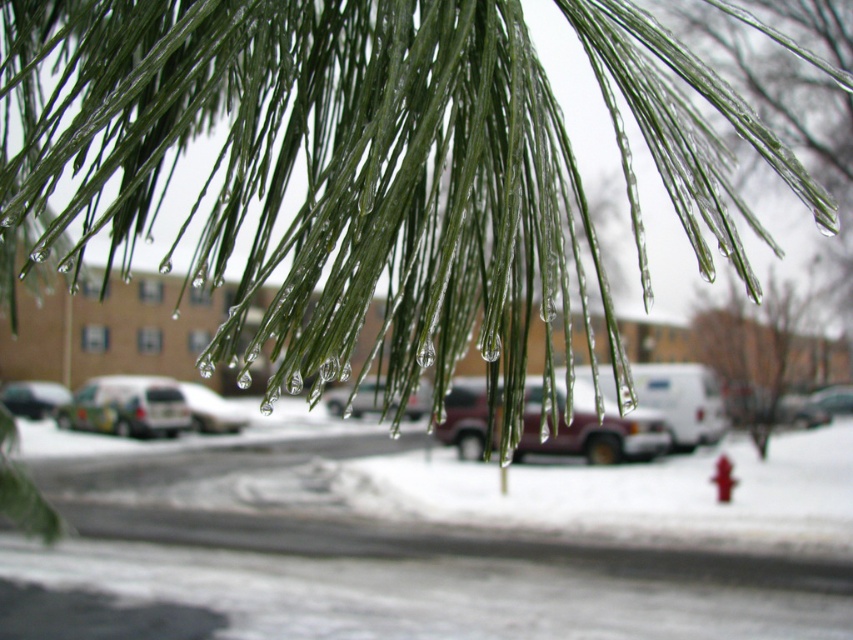
You are a delivery person trying to locate a white matte van at lower left. From your perspective, is the green matte pine branch at center blocking your view of the van?

The green matte pine branch at center is to the right of the white matte van at lower left, so it is blocking the view of the van.

You are a delivery driver who needs to park your car in the parking lot shown in the image. You see the green matte pine branch at center and the white matte van at lower left. Which object is closer to the ground?

The white matte van at lower left is closer to the ground because the green matte pine branch at center is located above it.